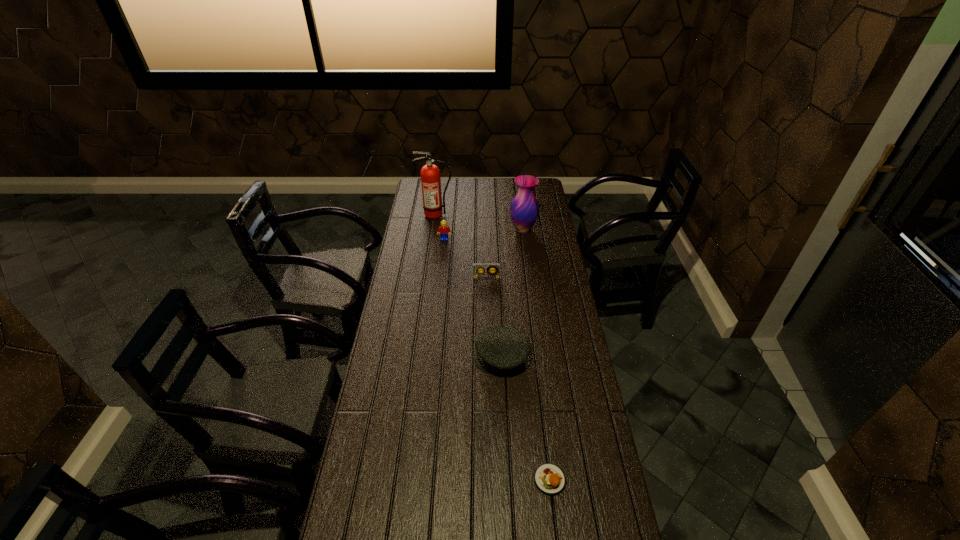
Image resolution: width=960 pixels, height=540 pixels. Identify the location of patty (food) that is at the right edge. (549, 479).

The height and width of the screenshot is (540, 960). What are the coordinates of `vacant point at the far edge` in the screenshot? It's located at (474, 183).

In the image, there is a desktop. Identify the location of free region at the left edge. This screenshot has width=960, height=540. (398, 351).

Locate an element on the screen. vacant space at the right edge of the desktop is located at coordinates (558, 284).

You are a GUI agent. You are given a task and a screenshot of the screen. Output one action in this format:
    pyautogui.click(x=<x>, y=<y>)
    Task: Click on the vacant point located between the beret and the vase
    The width and height of the screenshot is (960, 540).
    Given the screenshot: What is the action you would take?
    pyautogui.click(x=513, y=293)

The height and width of the screenshot is (540, 960). I want to click on free space between the vase and the Lego, so click(484, 234).

At what (x,y) coordinates should I click in order to perform the action: click on free space between the fifth tallest object and the vase. Please return your answer as a coordinate pair (x, y). Image resolution: width=960 pixels, height=540 pixels. Looking at the image, I should click on (505, 254).

Where is `free space between the nearest object and the fifth farthest object`? The image size is (960, 540). free space between the nearest object and the fifth farthest object is located at coordinates (525, 418).

The width and height of the screenshot is (960, 540). Find the location of `vacant region between the patty (food) and the second tallest object`. vacant region between the patty (food) and the second tallest object is located at coordinates (537, 355).

Where is `free space between the videotape and the Lego`? free space between the videotape and the Lego is located at coordinates (x=466, y=259).